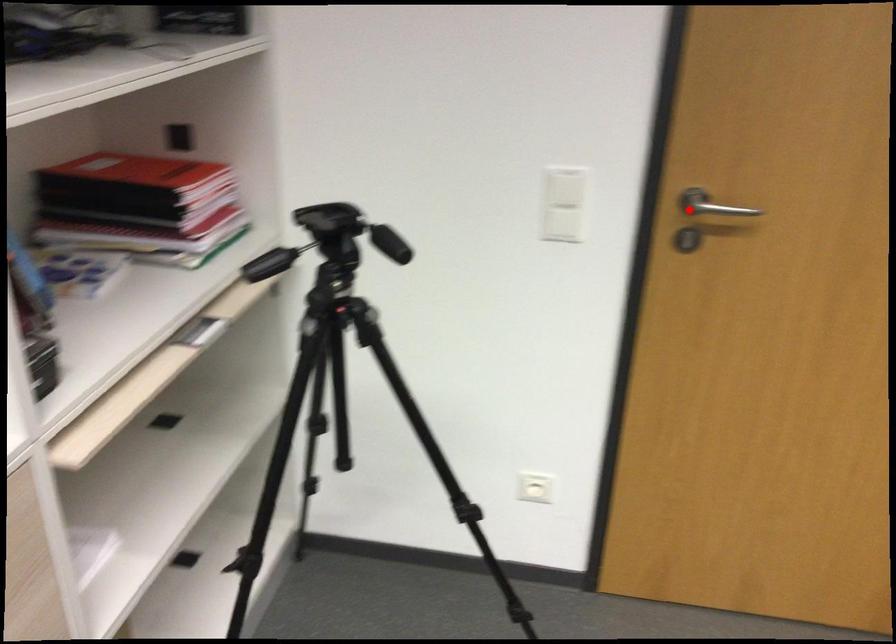
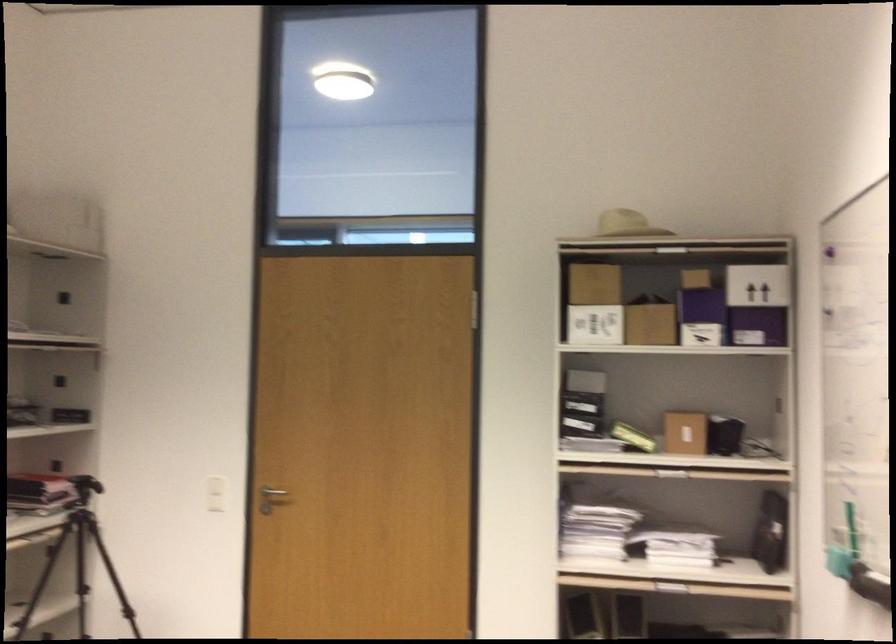
Where in the second image is the point corresponding to the highlighted location from the first image?

(272, 491)